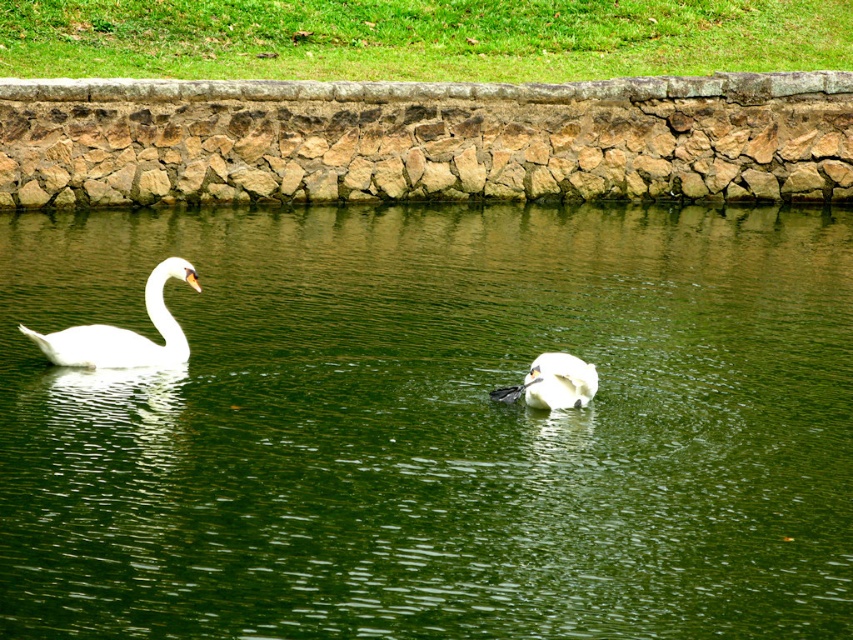
You are a photographer wanting to capture both the green liquid water at center and the white glossy swan at left in a single shot. Given that the camera can only focus on one object at a time, which object should you prioritize focusing on to ensure it takes up more space in the frame?

The green liquid water at center is bigger than the white glossy swan at left, so you should prioritize focusing on the green liquid water at center to ensure it takes up more space in the frame.

You are a small boat operator who needs to navigate between the green liquid water at center and the white matte swan at center. Can you safely pass through the area between them?

The green liquid water at center might be wider than white matte swan at center, so there is a possibility that the boat can pass safely. However, the exact width is uncertain, so caution is advised.

You are a wildlife photographer standing on the edge of the pond. You want to capture a photo of both the white glossy swan at left and the white matte swan at center in the same frame. Given that your camera has a maximum focus range of 2 meters, will you be able to include both swans in your shot?

The distance between the white glossy swan at left and the white matte swan at center is 2.59 meters. Since your camera can only focus up to 2 meters, you won